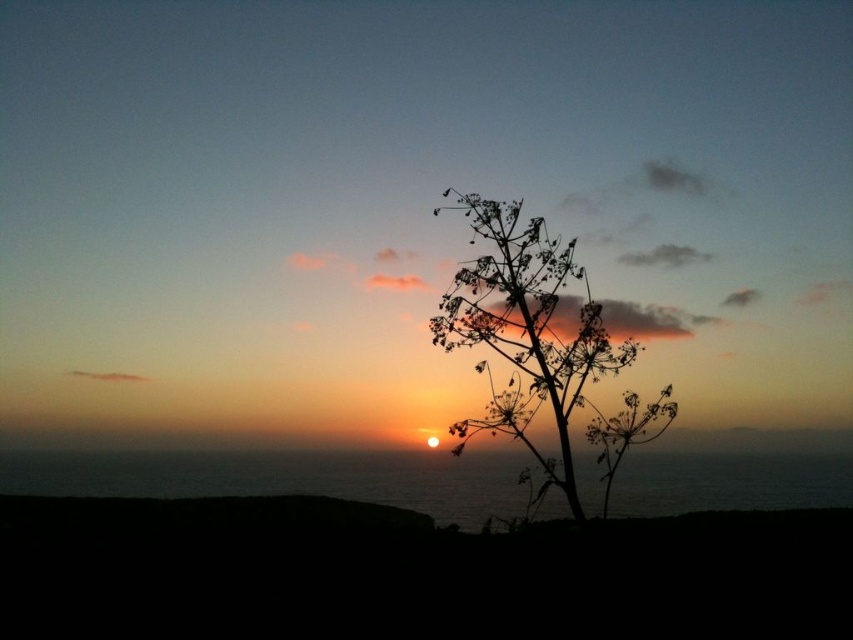
You are standing on the shore looking at the sunset scene. You see the transparent water at lower center and the silhouette wood at center. Which object is positioned to the left of the other?

The transparent water at lower center is to the left of the silhouette wood at center.

You are standing at the center of the scene and want to walk towards the two points marked in the image. Which point, point (422, 461) or point (505, 321), will you reach first?

You will reach point (505, 321) first because it is closer to you than point (422, 461), which is further away.

You are a photographer trying to capture the sunset. You notice the transparent water at lower center and the silhouette wood at center in your viewfinder. Which object will occupy more space in your photo?

The transparent water at lower center will occupy more space in the photo because it is bigger than the silhouette wood at center according to the description.